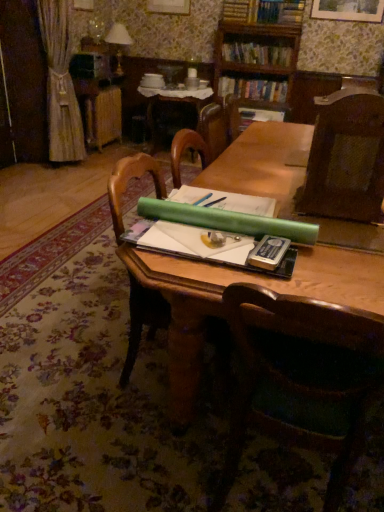
This screenshot has width=384, height=512. I want to click on free space between brown textured chair at right, which is counted as the 2th chair, starting from the bottom, and metallic silver paperback book at center, so click(328, 236).